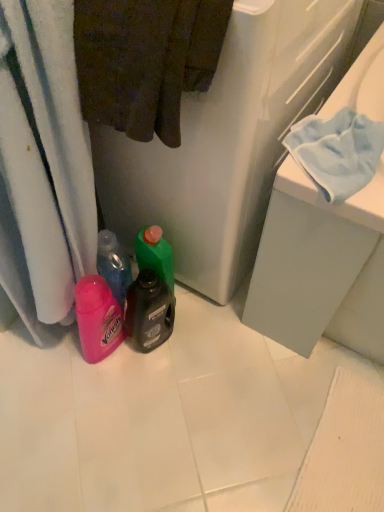
Question: Is white plastic laundry at center completely or partially inside brown cotton towel at upper left?

Choices:
 (A) yes
 (B) no

Answer: (B)

Question: From a real-world perspective, is brown cotton towel at upper left under white plastic laundry at center?

Choices:
 (A) yes
 (B) no

Answer: (B)

Question: Can you confirm if brown cotton towel at upper left is positioned to the left of white plastic laundry at center?

Choices:
 (A) yes
 (B) no

Answer: (A)

Question: From the image's perspective, would you say brown cotton towel at upper left is shown under white plastic laundry at center?

Choices:
 (A) no
 (B) yes

Answer: (B)

Question: Does brown cotton towel at upper left have a lesser width compared to white plastic laundry at center?

Choices:
 (A) yes
 (B) no

Answer: (A)

Question: Is brown cotton towel at upper left positioned behind white plastic laundry at center?

Choices:
 (A) yes
 (B) no

Answer: (B)

Question: Does white plastic laundry at center have a smaller size compared to brown cotton towel at upper left?

Choices:
 (A) yes
 (B) no

Answer: (B)

Question: From a real-world perspective, does white plastic laundry at center sit lower than brown cotton towel at upper left?

Choices:
 (A) no
 (B) yes

Answer: (B)

Question: From the image's perspective, is white plastic laundry at center located above brown cotton towel at upper left?

Choices:
 (A) yes
 (B) no

Answer: (A)

Question: From a real-world perspective, does white plastic laundry at center stand above brown cotton towel at upper left?

Choices:
 (A) yes
 (B) no

Answer: (B)

Question: Can you confirm if white plastic laundry at center is positioned to the left of brown cotton towel at upper left?

Choices:
 (A) no
 (B) yes

Answer: (A)

Question: Can you confirm if white plastic laundry at center is bigger than brown cotton towel at upper left?

Choices:
 (A) yes
 (B) no

Answer: (A)

Question: Considering the positions of white plastic laundry at center and brown cotton towel at upper left in the image, is white plastic laundry at center bigger or smaller than brown cotton towel at upper left?

Choices:
 (A) small
 (B) big

Answer: (B)